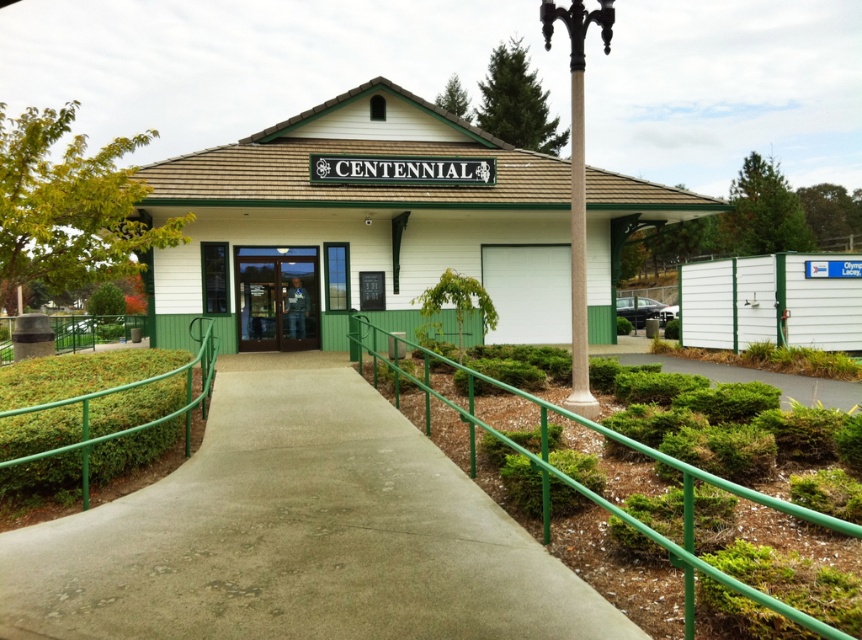
You are a wheelchair user approaching the entrance of the building. You see the green metallic railing at center and the transparent glass door at center. Which object should you move toward to access the entrance?

You should move toward the transparent glass door at center because the green metallic railing at center is located to the right of the door, indicating the door is the entrance point.

You are a wheelchair user approaching the entrance of the building. The ramp has a green metallic railing at center and a transparent glass door at center. Which object would you need to adjust your position to avoid hitting as you move forward?

The transparent glass door at center is taller than the green metallic railing at center, so you would need to adjust your position to avoid hitting the transparent glass door at center.